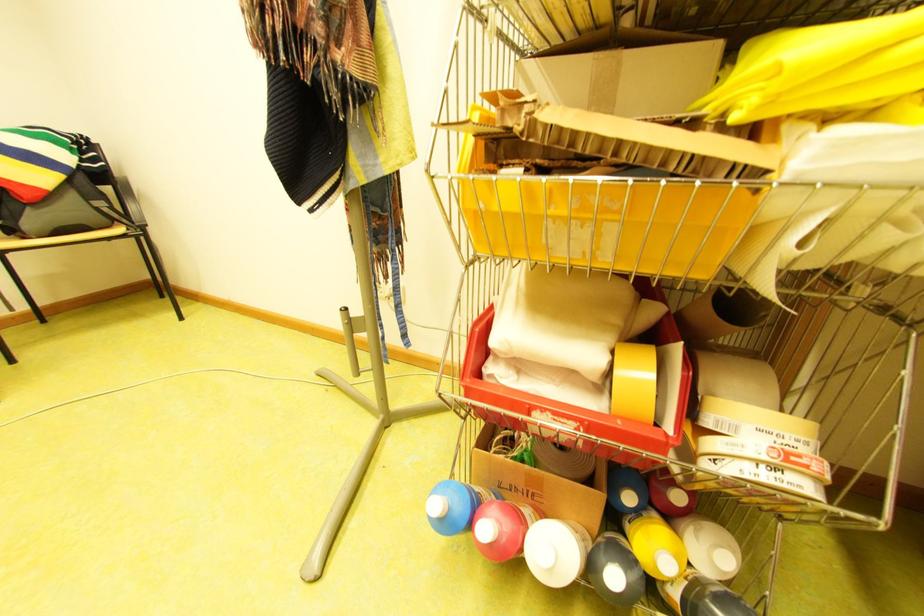
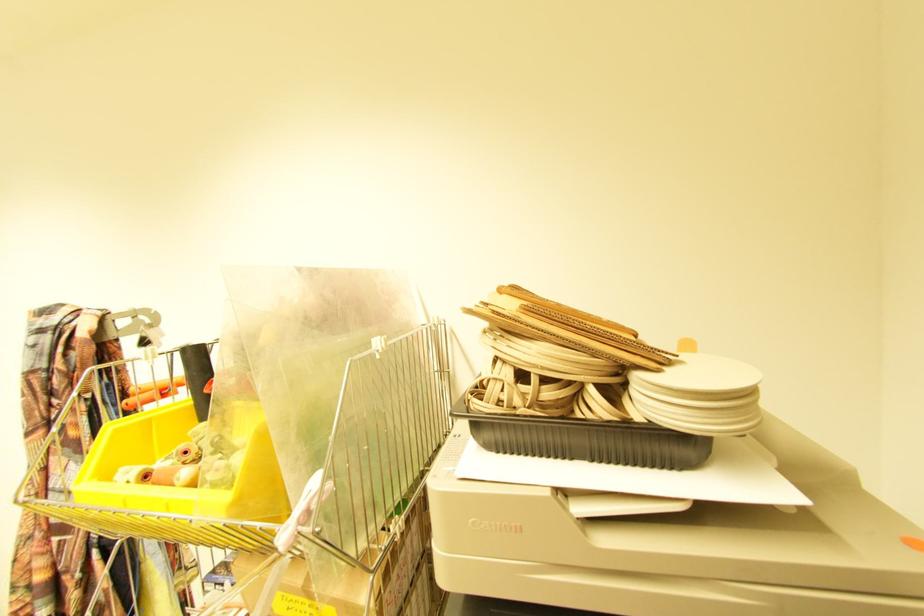
Which direction would the cameraman need to move to produce the second image?

The cameraman walked toward right, backward.